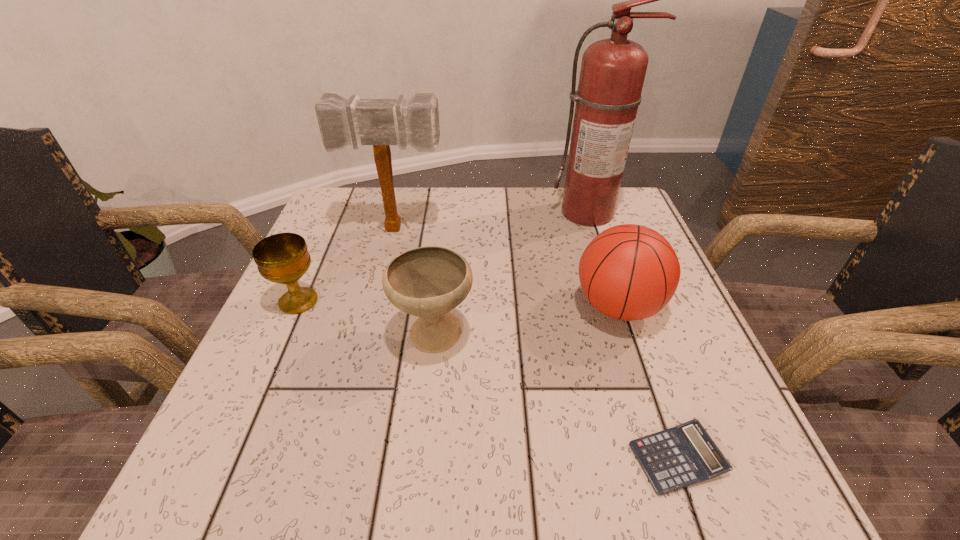
Where is `vacant space at the near left corner of the desktop`? vacant space at the near left corner of the desktop is located at coordinates (215, 481).

What are the coordinates of `vacant space at the far right corner` in the screenshot? It's located at (599, 227).

At what (x,y) coordinates should I click in order to perform the action: click on vacant region between the basketball and the right chalice. Please return your answer as a coordinate pair (x, y). The width and height of the screenshot is (960, 540). Looking at the image, I should click on (526, 321).

Where is `vacant space in between the shorter chalice and the right chalice`? Image resolution: width=960 pixels, height=540 pixels. vacant space in between the shorter chalice and the right chalice is located at coordinates (366, 319).

The width and height of the screenshot is (960, 540). Find the location of `free space between the shorter chalice and the right chalice`. free space between the shorter chalice and the right chalice is located at coordinates (366, 319).

This screenshot has width=960, height=540. Identify the location of blank region between the right chalice and the fire extinguisher. (511, 274).

Where is `free point between the left chalice and the right chalice`? The height and width of the screenshot is (540, 960). free point between the left chalice and the right chalice is located at coordinates (366, 319).

You are a GUI agent. You are given a task and a screenshot of the screen. Output one action in this format:
    pyautogui.click(x=<x>, y=<y>)
    Task: Click on the empty space between the shorter chalice and the fifth shortest object
    This screenshot has height=540, width=960.
    Given the screenshot: What is the action you would take?
    pyautogui.click(x=348, y=265)

Image resolution: width=960 pixels, height=540 pixels. I want to click on free space between the calculator and the basketball, so click(647, 383).

Locate an element on the screen. This screenshot has height=540, width=960. object that is the closest to the right chalice is located at coordinates (283, 258).